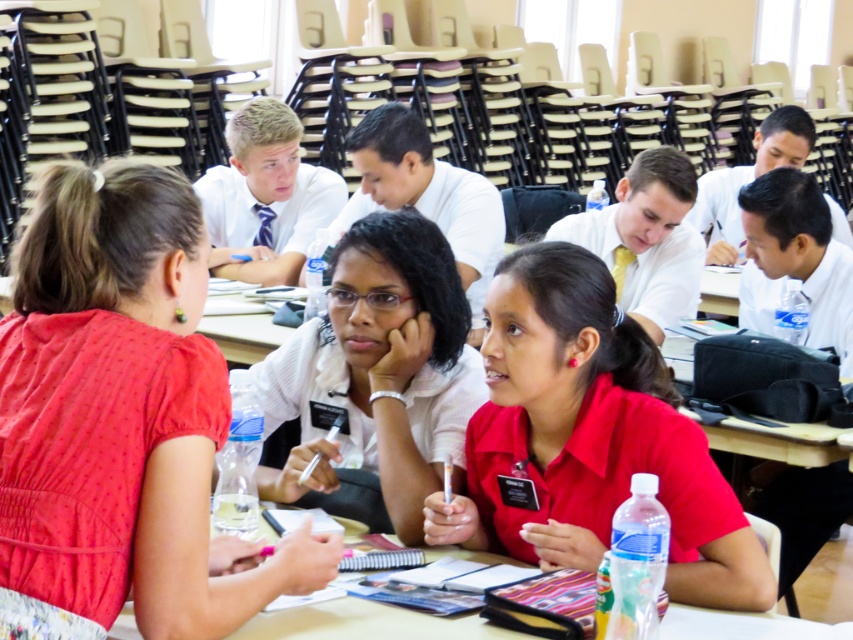
Question: Among these points, which one is nearest to the camera?

Choices:
 (A) (699, 609)
 (B) (485, 392)
 (C) (216, 592)
 (D) (641, 236)

Answer: (C)

Question: Is matte red blouse at center smaller than matte white shirt at center?

Choices:
 (A) yes
 (B) no

Answer: (A)

Question: Which object is the farthest from the white glossy shirt at upper center?

Choices:
 (A) red matte shirt at center
 (B) smooth wooden table at center
 (C) white glossy shirt at center
 (D) matte red blouse at center

Answer: (B)

Question: Does smooth wooden table at center have a lesser width compared to matte white shirt at center?

Choices:
 (A) no
 (B) yes

Answer: (B)

Question: Can you confirm if white glossy shirt at center is thinner than white glossy shirt at upper center?

Choices:
 (A) no
 (B) yes

Answer: (B)

Question: Which is farther from the white glossy shirt at center?

Choices:
 (A) matte white shirt at center
 (B) matte red blouse at center
 (C) white glossy shirt at upper center

Answer: (C)